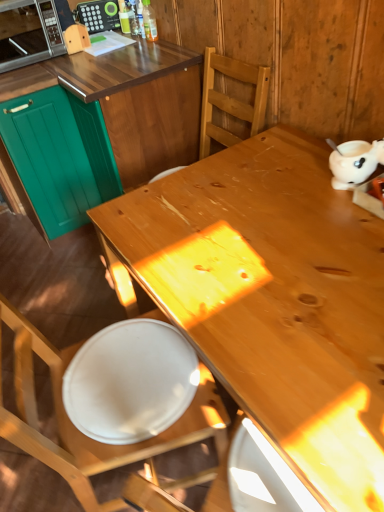
I want to click on free point above white glossy plate at lower left (from a real-world perspective), so [x=130, y=362].